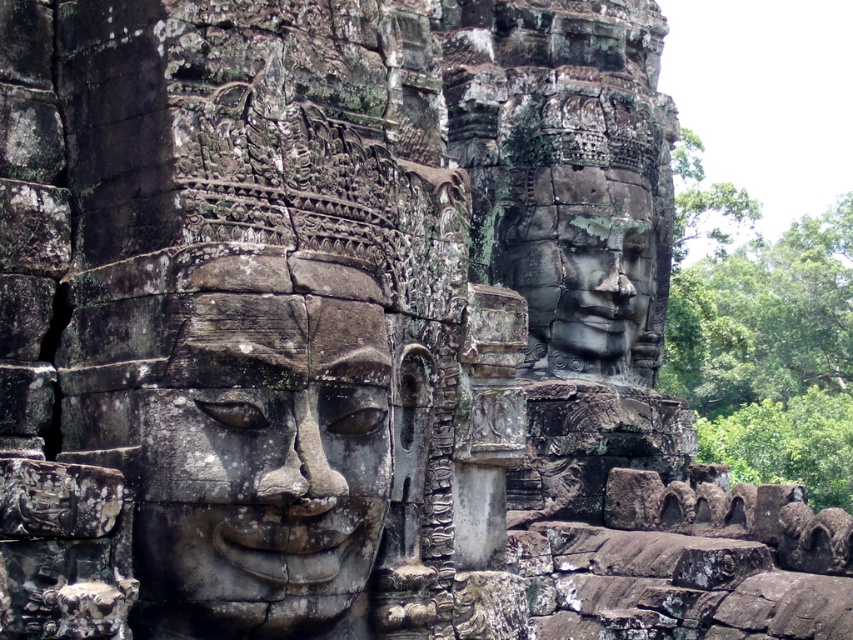
You are an archaeologist examining the ancient stone structure. You notice two gray stone faces. Which one is closer to you, the gray stone face at center or the gray stone face at upper center?

The gray stone face at center is closer to you because it is in front of the gray stone face at upper center.